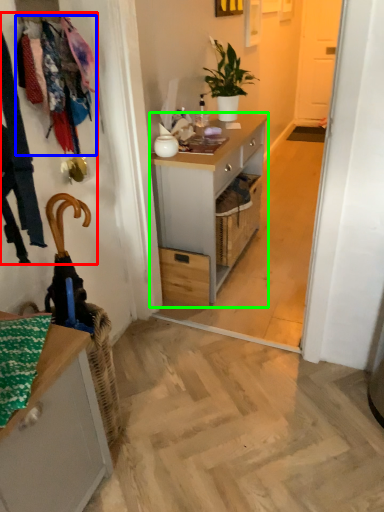
Question: Estimate the real-world distances between objects in this image. Which object is closer to laundry (highlighted by a red box), clothesline (highlighted by a blue box) or desk (highlighted by a green box)?

Choices:
 (A) clothesline
 (B) desk

Answer: (A)